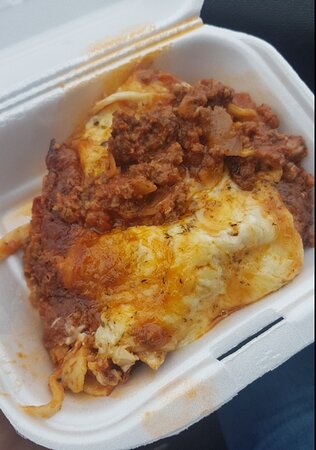
Identify the location of plate. click(x=41, y=146).